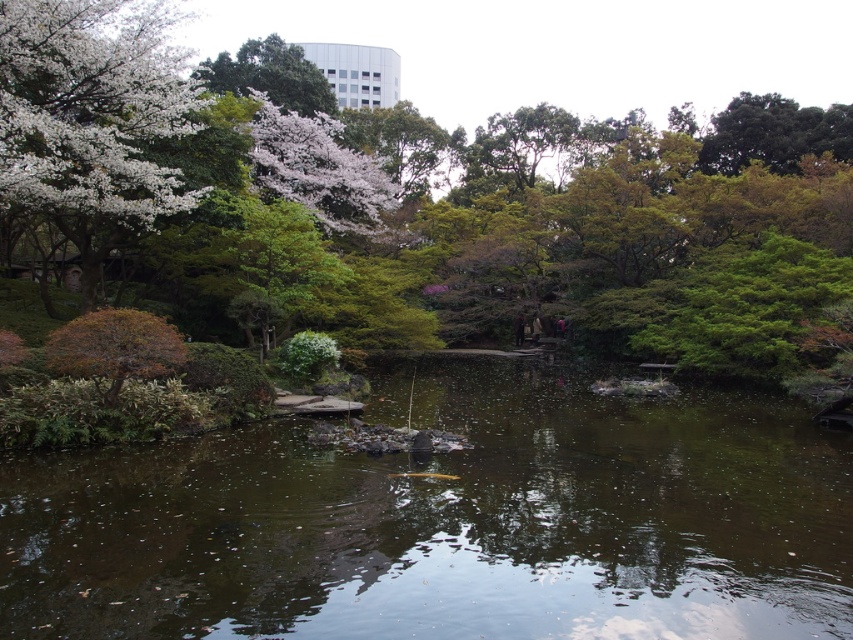
Question: Is green leafy tree at center below brown murky water at center?

Choices:
 (A) no
 (B) yes

Answer: (A)

Question: Among these points, which one is nearest to the camera?

Choices:
 (A) (119, 154)
 (B) (583, 401)
 (C) (627, 216)

Answer: (A)

Question: Is green leafy tree at center in front of brown murky water at center?

Choices:
 (A) no
 (B) yes

Answer: (A)

Question: In this image, where is green leafy tree at center located relative to brown murky water at center?

Choices:
 (A) left
 (B) right

Answer: (B)

Question: Which point is closer to the camera taking this photo?

Choices:
 (A) (239, 497)
 (B) (44, 168)

Answer: (A)

Question: Among these objects, which one is farthest from the camera?

Choices:
 (A) white blossoming tree at upper left
 (B) green leafy tree at center
 (C) brown murky water at center

Answer: (B)